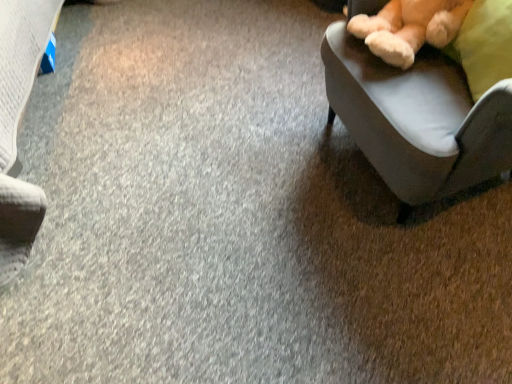
Find the location of `soft plush teddy bear at upper right`. soft plush teddy bear at upper right is located at coordinates (409, 28).

What do you see at coordinates (409, 28) in the screenshot?
I see `soft plush teddy bear at upper right` at bounding box center [409, 28].

Describe the element at coordinates (417, 120) in the screenshot. The image size is (512, 384). I see `velvet-like beige chair at right` at that location.

Measure the distance between velvet-like beige chair at right and camera.

38.15 inches.

Locate an element on the screen. velvet-like beige chair at right is located at coordinates (417, 120).

What are the coordinates of `soft plush teddy bear at upper right` in the screenshot? It's located at (409, 28).

Which is more to the left, velvet-like beige chair at right or soft plush teddy bear at upper right?

Positioned to the left is soft plush teddy bear at upper right.

Is the depth of velvet-like beige chair at right less than that of soft plush teddy bear at upper right?

Yes, velvet-like beige chair at right is closer to the camera.

Which is closer to the camera, (401, 122) or (348, 22)?

Point (401, 122) appears to be closer to the viewer than point (348, 22).

From the image's perspective, which is above, velvet-like beige chair at right or soft plush teddy bear at upper right?

soft plush teddy bear at upper right is shown above in the image.

From a real-world perspective, is velvet-like beige chair at right below soft plush teddy bear at upper right?

Yes, from a real-world perspective, velvet-like beige chair at right is under soft plush teddy bear at upper right.

Which object is thinner, velvet-like beige chair at right or soft plush teddy bear at upper right?

With smaller width is soft plush teddy bear at upper right.

Is velvet-like beige chair at right shorter than soft plush teddy bear at upper right?

No, velvet-like beige chair at right is not shorter than soft plush teddy bear at upper right.

Between velvet-like beige chair at right and soft plush teddy bear at upper right, which one has smaller size?

soft plush teddy bear at upper right.

Consider the image. Can we say velvet-like beige chair at right lies outside soft plush teddy bear at upper right?

Yes, velvet-like beige chair at right is located beyond the bounds of soft plush teddy bear at upper right.

Is velvet-like beige chair at right beside soft plush teddy bear at upper right?

No, velvet-like beige chair at right is not in contact with soft plush teddy bear at upper right.

Is velvet-like beige chair at right oriented towards soft plush teddy bear at upper right?

Yes, velvet-like beige chair at right is aimed at soft plush teddy bear at upper right.

Can you tell me how much velvet-like beige chair at right and soft plush teddy bear at upper right differ in facing direction?

8.16 degrees.

How far apart are velvet-like beige chair at right and soft plush teddy bear at upper right?

They are 18.54 centimeters apart.

In the image, there is a soft plush teddy bear at upper right. Where is `chair below it (from the image's perspective)`? chair below it (from the image's perspective) is located at coordinates (417, 120).

Considering the relative positions of soft plush teddy bear at upper right and velvet-like beige chair at right in the image provided, is soft plush teddy bear at upper right to the right of velvet-like beige chair at right from the viewer's perspective?

Incorrect, soft plush teddy bear at upper right is not on the right side of velvet-like beige chair at right.

Is soft plush teddy bear at upper right positioned behind velvet-like beige chair at right?

Yes, it is.

Does point (437, 8) appear closer or farther from the camera than point (468, 163)?

Point (437, 8) appears to be farther away from the viewer than point (468, 163).

Consider the image. From the image's perspective, does soft plush teddy bear at upper right appear higher than velvet-like beige chair at right?

Yes, from the image's perspective, soft plush teddy bear at upper right is on top of velvet-like beige chair at right.

From a real-world perspective, who is located higher, soft plush teddy bear at upper right or velvet-like beige chair at right?

soft plush teddy bear at upper right is physically above.

Which of these two, soft plush teddy bear at upper right or velvet-like beige chair at right, is thinner?

soft plush teddy bear at upper right is thinner.

Considering the sizes of soft plush teddy bear at upper right and velvet-like beige chair at right in the image, is soft plush teddy bear at upper right taller or shorter than velvet-like beige chair at right?

soft plush teddy bear at upper right is shorter than velvet-like beige chair at right.

Which of these two, soft plush teddy bear at upper right or velvet-like beige chair at right, is smaller?

With smaller size is soft plush teddy bear at upper right.

Would you say soft plush teddy bear at upper right is inside or outside velvet-like beige chair at right?

soft plush teddy bear at upper right is inside velvet-like beige chair at right.

Is soft plush teddy bear at upper right in contact with velvet-like beige chair at right?

soft plush teddy bear at upper right is not next to velvet-like beige chair at right, and they're not touching.

Is velvet-like beige chair at right at the back of soft plush teddy bear at upper right?

That's right, soft plush teddy bear at upper right is facing away from velvet-like beige chair at right.

Can you tell me how much soft plush teddy bear at upper right and velvet-like beige chair at right differ in facing direction?

soft plush teddy bear at upper right and velvet-like beige chair at right are facing 8.16 degrees away from each other.

In the scene shown: How distant is soft plush teddy bear at upper right from velvet-like beige chair at right?

The distance of soft plush teddy bear at upper right from velvet-like beige chair at right is 7.30 inches.

Find the location of `chair below the soft plush teddy bear at upper right (from the image's perspective)`. chair below the soft plush teddy bear at upper right (from the image's perspective) is located at coordinates (417, 120).

The image size is (512, 384). Identify the location of chair below the soft plush teddy bear at upper right (from a real-world perspective). (417, 120).

Where is `chair that appears below the soft plush teddy bear at upper right (from the image's perspective)`? The image size is (512, 384). chair that appears below the soft plush teddy bear at upper right (from the image's perspective) is located at coordinates (417, 120).